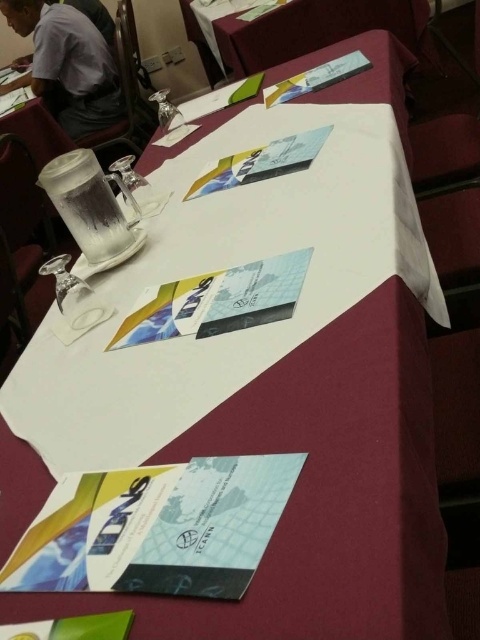
You are at a formal event and want to grab a cup quickly. There are two cups marked as point A at coordinates point (233, 17) and point B at coordinates point (87, 49). Which cup should you reach for first if you want the one closest to you?

You should reach for the cup at point (233, 17) first because it is closer to you compared to the cup at point (87, 49).